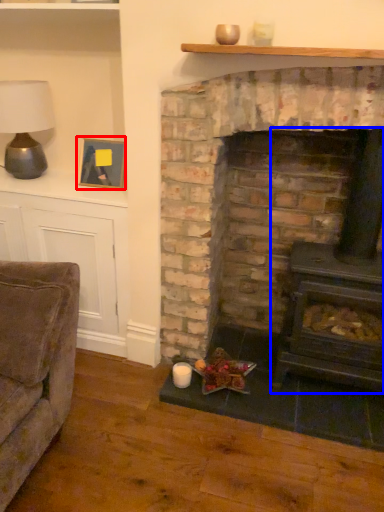
Question: Which point is closer to the camera, picture frame (highlighted by a red box) or wood burning stove (highlighted by a blue box)?

Choices:
 (A) picture frame
 (B) wood burning stove

Answer: (B)